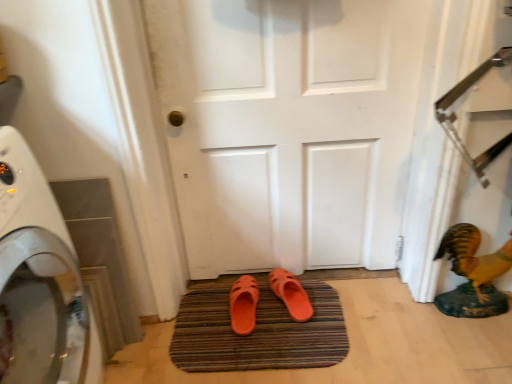
At what (x,y) coordinates should I click in order to perform the action: click on vacant space to the right of orange rubber slipper at center, the 2th footwear from the right. Please return your answer as a coordinate pair (x, y). Image resolution: width=512 pixels, height=384 pixels. Looking at the image, I should click on (290, 317).